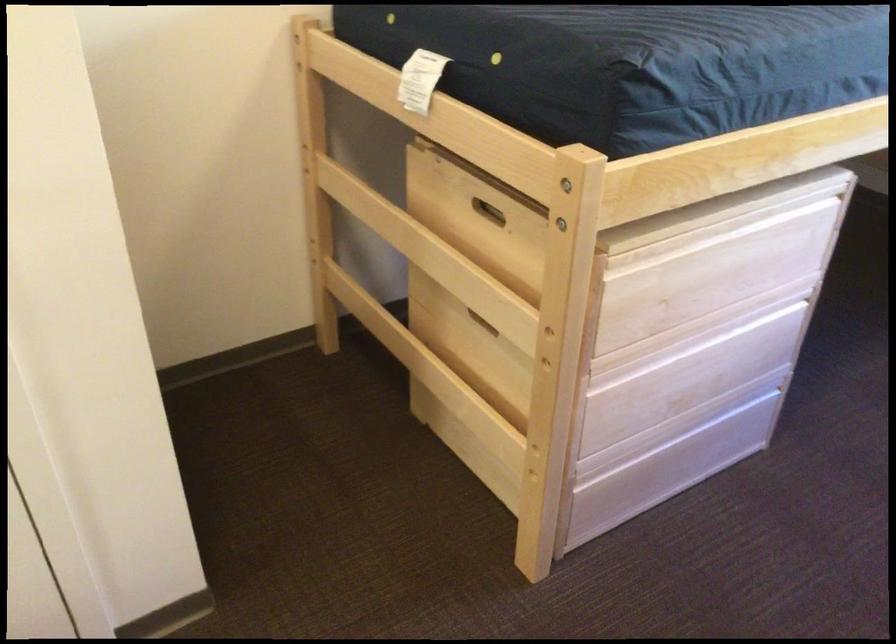
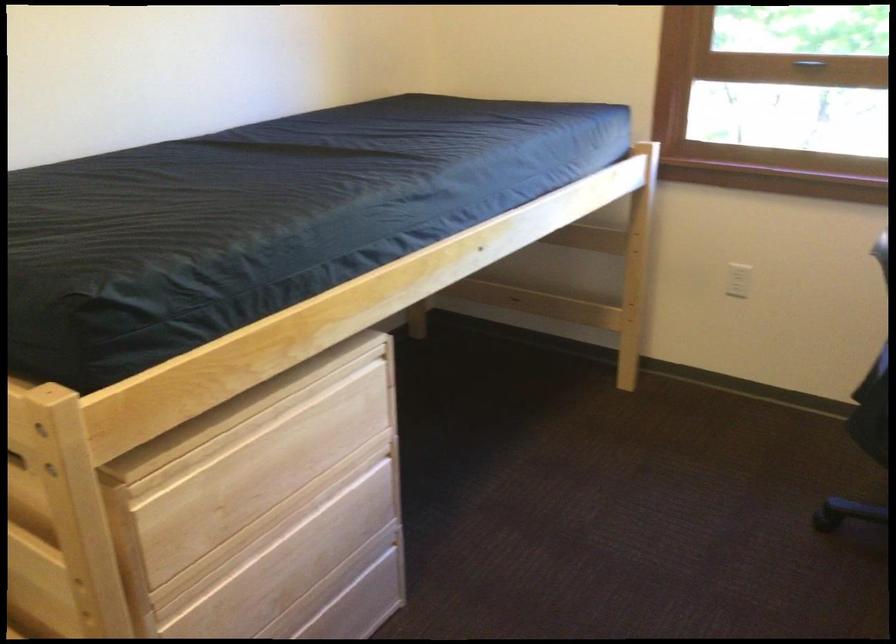
The point at [642,390] is marked in the first image. Where is the corresponding point in the second image?

(230, 601)